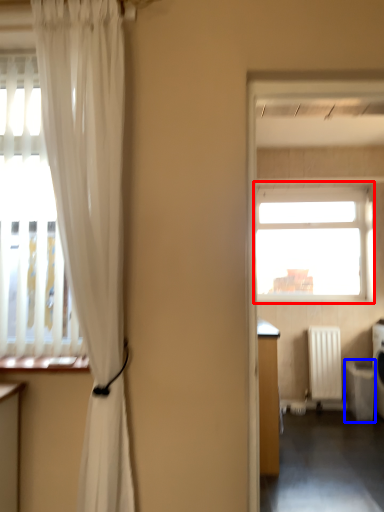
Question: Which point is further to the camera, window (highlighted by a red box) or dish washer (highlighted by a blue box)?

Choices:
 (A) window
 (B) dish washer

Answer: (A)